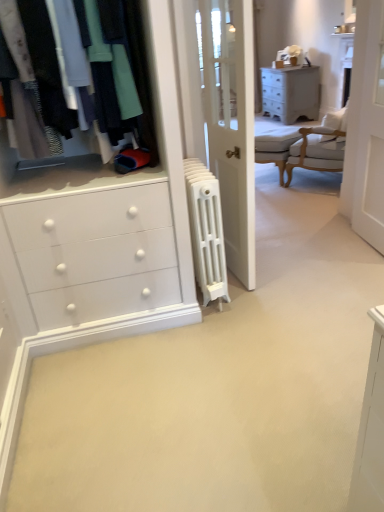
The width and height of the screenshot is (384, 512). What are the coordinates of `vacant space in white wood screen door at upper right (from a real-world perspective)` in the screenshot? It's located at (363, 246).